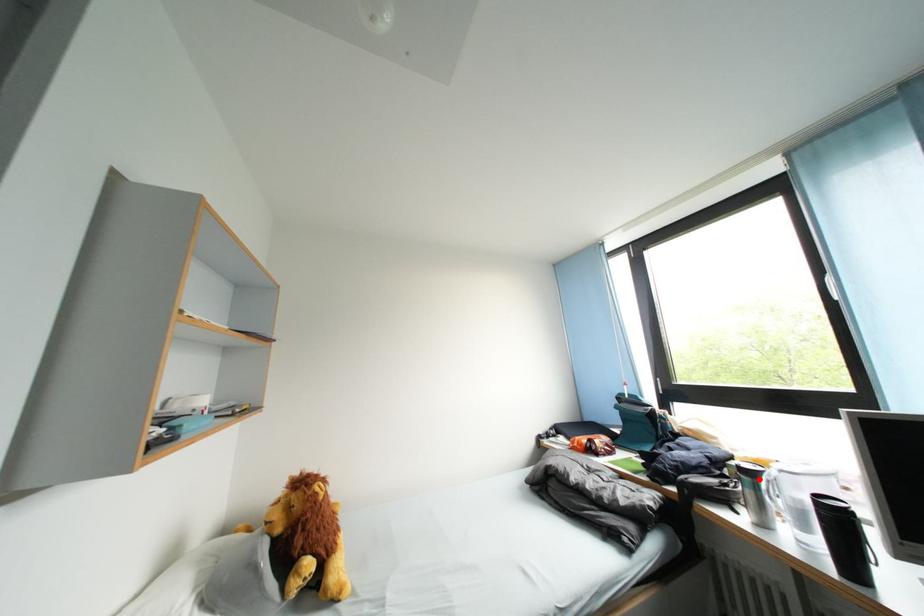
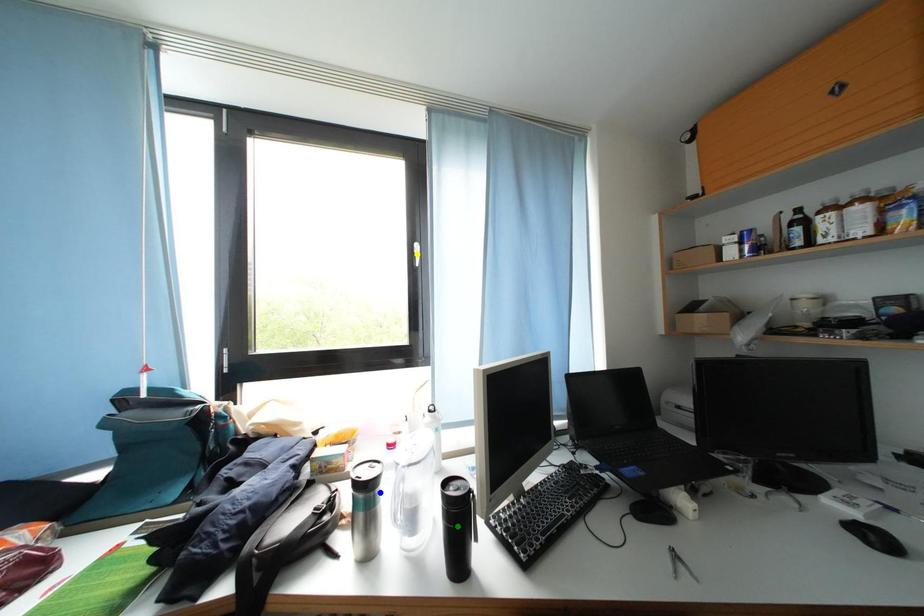
Question: I am providing you with two images of the same scene from different viewpoints. A red point is marked on the first image. You are given multiple points on the second image. Which point in image 2 is actually the same real-world point as the red point in image 1?

Choices:
 (A) green point
 (B) yellow point
 (C) blue point

Answer: (C)